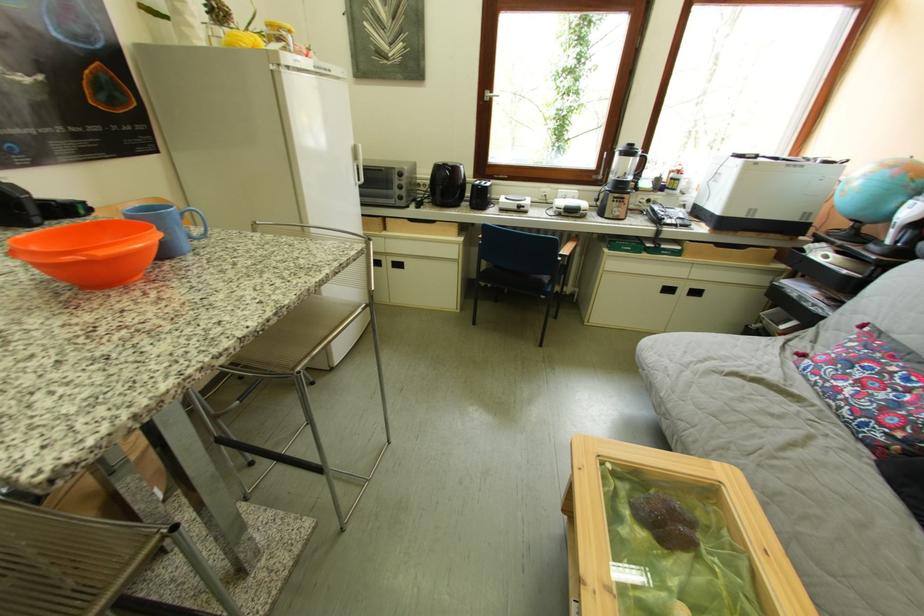
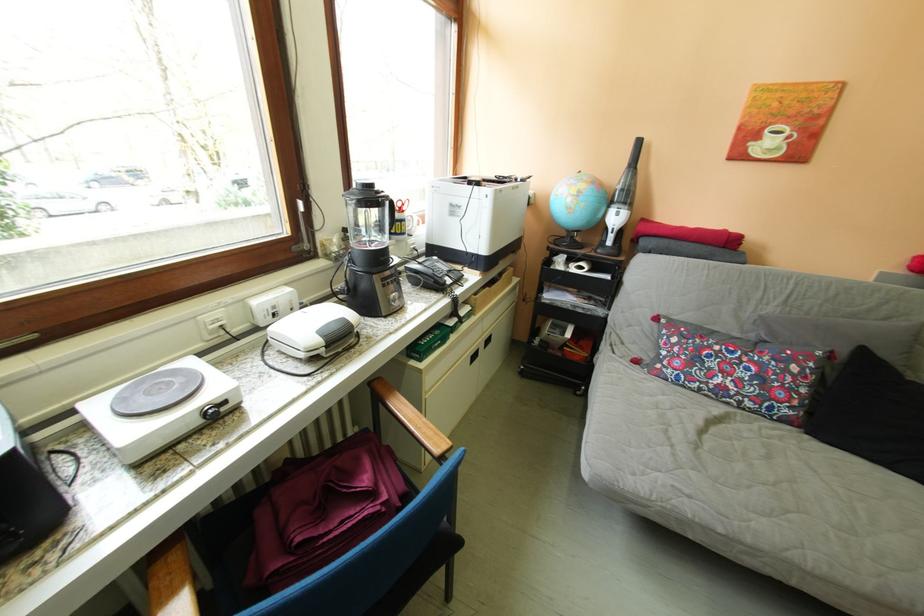
Locate, in the second image, the point that corresponds to point 625,214 in the first image.

(402, 304)